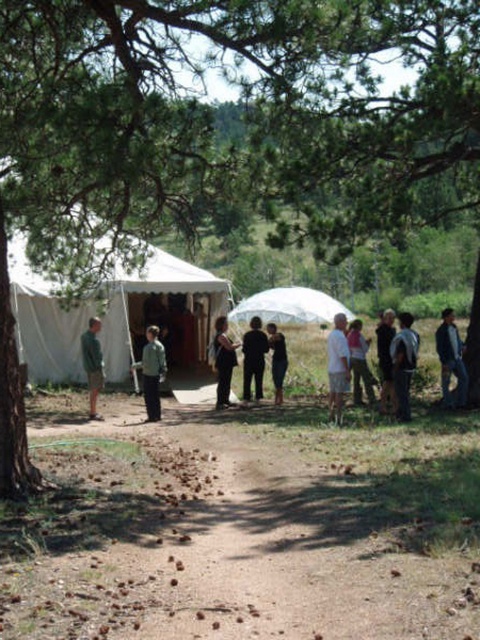
You are an observer standing at the entrance of the tent and see both the dark gray fabric jacket at center and the dark brown leather jacket at center. Which jacket is taller?

The dark gray fabric jacket at center is taller than the dark brown leather jacket at center.

You are standing at the edge of the dirt path in the campsite and see both the dark gray fabric jacket at center and the dark brown leather jacket at center. Which jacket is nearer to you?

The dark gray fabric jacket at center is closer to the viewer than the dark brown leather jacket at center.

You are an outdoor enthusiast planning to retrieve your jacket from the scene. You see the brown leather jacket at right and the dark brown leather jacket at center. Which jacket is closer to you?

The brown leather jacket at right is closer to you because it is in front of the dark brown leather jacket at center.